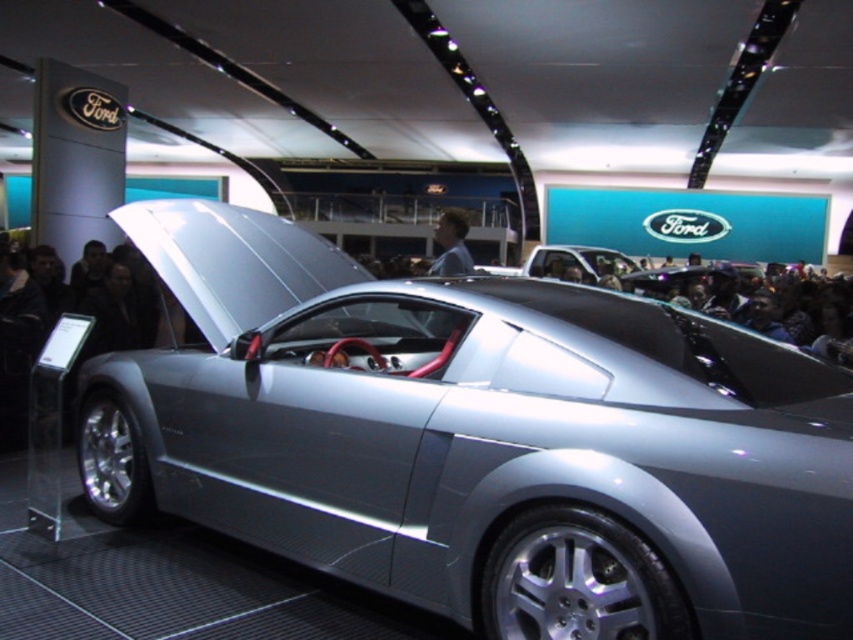
Who is lower down, satin silver car at center or smooth skin face at center?

satin silver car at center is below.

Does satin silver car at center have a lesser width compared to smooth skin face at center?

No, satin silver car at center is not thinner than smooth skin face at center.

Describe the element at coordinates (577, 262) in the screenshot. The image size is (853, 640). I see `satin silver car at center` at that location.

I want to click on satin silver car at center, so click(577, 262).